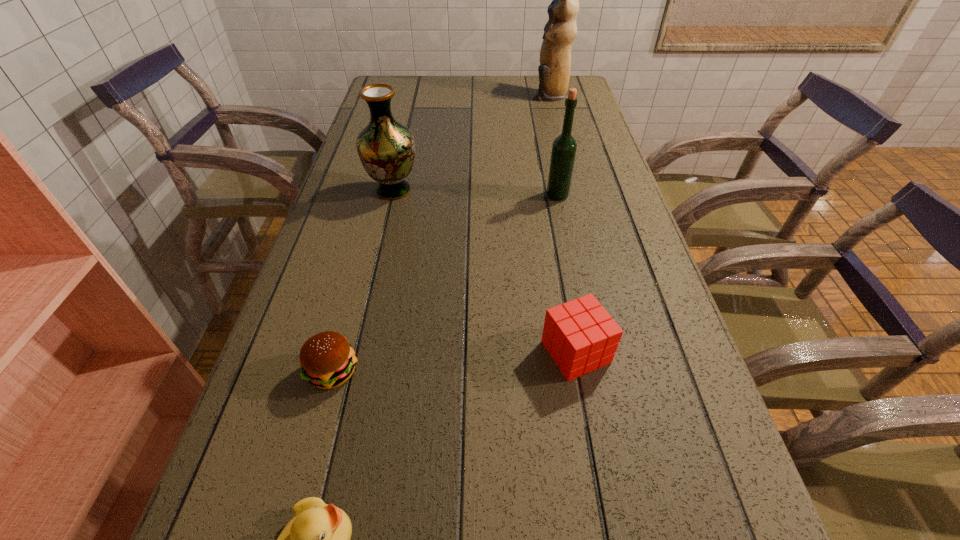
I want to click on vacant space located 0.310m on the front of the vase, so click(x=369, y=298).

You are a GUI agent. You are given a task and a screenshot of the screen. Output one action in this format:
    pyautogui.click(x=<x>, y=<y>)
    Task: Click on the vacant space located on the left of the cube
    This screenshot has height=540, width=960.
    Given the screenshot: What is the action you would take?
    pyautogui.click(x=445, y=352)

Locate an element on the screen. Image resolution: width=960 pixels, height=540 pixels. vacant space situated on the right of the hamburger is located at coordinates (499, 372).

At what (x,y) coordinates should I click in order to perform the action: click on object at the far edge. Please return your answer as a coordinate pair (x, y). The image size is (960, 540). Looking at the image, I should click on (560, 31).

Where is `vase that is at the left edge`? This screenshot has height=540, width=960. vase that is at the left edge is located at coordinates (386, 148).

Find the location of a particular element. The width and height of the screenshot is (960, 540). hamburger that is at the left edge is located at coordinates (327, 360).

What are the coordinates of `cat located in the right edge section of the desktop` in the screenshot? It's located at (560, 31).

At what (x,y) coordinates should I click in order to perform the action: click on liquor situated at the right edge. Please return your answer as a coordinate pair (x, y). This screenshot has width=960, height=540. Looking at the image, I should click on (564, 147).

This screenshot has height=540, width=960. I want to click on cube at the right edge, so click(x=580, y=335).

Where is `object that is positioned at the far right corner`? object that is positioned at the far right corner is located at coordinates (560, 31).